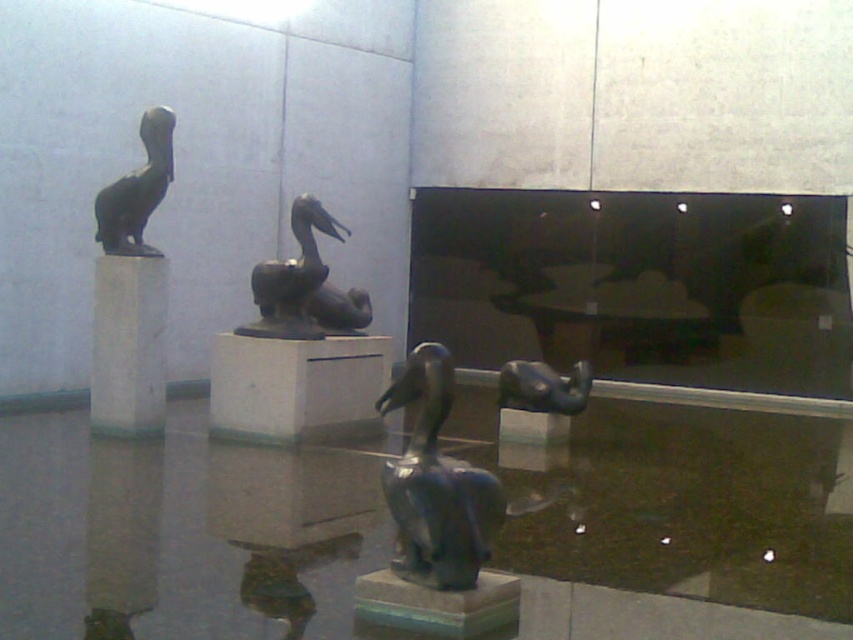
Question: Is white marble pillar at left positioned in front of bronze statue at center?

Choices:
 (A) yes
 (B) no

Answer: (A)

Question: Which object is positioned closest to the bronze statue at center?

Choices:
 (A) white marble pillar at left
 (B) white marble pedestal at center
 (C) shiny bronze pelican at center

Answer: (B)

Question: Which point is closer to the camera taking this photo?

Choices:
 (A) (425, 568)
 (B) (299, 435)
 (C) (341, 298)

Answer: (A)

Question: Estimate the real-world distances between objects in this image. Which object is closer to the bronze statue of a bird at upper left?

Choices:
 (A) shiny bronze pelican at center
 (B) bronze statue at center
 (C) white marble pillar at left
 (D) white marble pedestal at center

Answer: (C)

Question: Is bronze statue at center behind bronze statue of a bird at upper left?

Choices:
 (A) yes
 (B) no

Answer: (A)

Question: Is shiny bronze pelican at center below bronze statue at center?

Choices:
 (A) yes
 (B) no

Answer: (A)